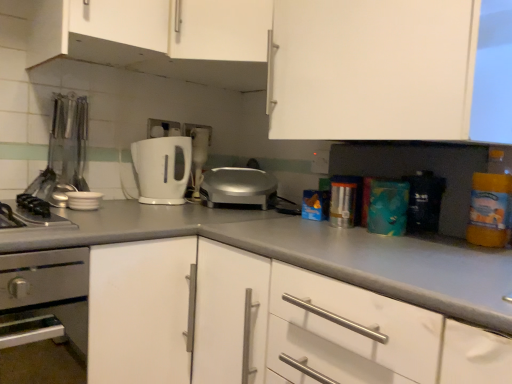
This screenshot has width=512, height=384. What do you see at coordinates (424, 201) in the screenshot? I see `teal matte box at center, which is the first appliance from right to left` at bounding box center [424, 201].

Describe the element at coordinates (161, 169) in the screenshot. I see `white glossy toaster at center, acting as the second toaster starting from the right` at that location.

From the picture: In order to face white matte cabinet at upper center, the 3th cabinetry positioned from the top, should I rotate leftwards or rightwards?

You should look right and rotate roughly 18.889 degrees.

How much space does white matte cabinet at upper center, the 3th cabinetry positioned from the top, occupy vertically?

53.85 centimeters.

I want to click on stainless steel oven at lower left, so click(44, 316).

In terms of height, does white glossy bowls at left, which is counted as the second appliance, starting from the left, look taller or shorter compared to metallic silver utensils at left, the 1th appliance positioned from the left?

white glossy bowls at left, which is counted as the second appliance, starting from the left, is shorter than metallic silver utensils at left, the 1th appliance positioned from the left.

Does white glossy bowls at left, the 2th appliance when ordered from right to left, touch metallic silver utensils at left, arranged as the third appliance when viewed from the right?

No, white glossy bowls at left, the 2th appliance when ordered from right to left, is not next to metallic silver utensils at left, arranged as the third appliance when viewed from the right.

Consider the image. Considering the positions of objects white glossy bowls at left, which is counted as the second appliance, starting from the left, and metallic silver utensils at left, the 1th appliance positioned from the left, in the image provided, who is in front, white glossy bowls at left, which is counted as the second appliance, starting from the left, or metallic silver utensils at left, the 1th appliance positioned from the left,?

Positioned in front is white glossy bowls at left, which is counted as the second appliance, starting from the left.

Do you think white glossy bowls at left, which is counted as the second appliance, starting from the left, is within metallic silver utensils at left, the 1th appliance positioned from the left, or outside of it?

white glossy bowls at left, which is counted as the second appliance, starting from the left, is not enclosed by metallic silver utensils at left, the 1th appliance positioned from the left.

Considering the sizes of objects teal matte box at center, which is the first appliance from right to left, and white plastic coffee machine at center in the image provided, who is bigger, teal matte box at center, which is the first appliance from right to left, or white plastic coffee machine at center?

With larger size is white plastic coffee machine at center.

From the picture: Is the surface of teal matte box at center, which is the first appliance from right to left, in direct contact with white plastic coffee machine at center?

No.

From a real-world perspective, who is located higher, teal matte box at center, the 3th appliance when ordered from left to right, or white plastic coffee machine at center?

white plastic coffee machine at center.

Is white matte countertop at center not within white matte cabinet at center, acting as the 4th cabinetry starting from the top?

Yes, white matte countertop at center is located beyond the bounds of white matte cabinet at center, acting as the 4th cabinetry starting from the top.

Can you confirm if white matte countertop at center is bigger than white matte cabinet at center, the first cabinetry in the bottom-to-top sequence?

Actually, white matte countertop at center might be smaller than white matte cabinet at center, the first cabinetry in the bottom-to-top sequence.

Considering the sizes of objects white matte countertop at center and white matte cabinet at center, acting as the 4th cabinetry starting from the top, in the image provided, who is wider, white matte countertop at center or white matte cabinet at center, acting as the 4th cabinetry starting from the top,?

With larger width is white matte countertop at center.

Where is `cabinetry below the white matte countertop at center (from a real-world perspective)`? The width and height of the screenshot is (512, 384). cabinetry below the white matte countertop at center (from a real-world perspective) is located at coordinates (310, 253).

Which object is more forward, teal matte box at center, which is the first appliance from right to left, or white matte cabinet at upper center, arranged as the fourth cabinetry when ordered from the bottom?

teal matte box at center, which is the first appliance from right to left.

Would you consider teal matte box at center, the 3th appliance when ordered from left to right, to be distant from white matte cabinet at upper center, which ranks as the 1th cabinetry in top-to-bottom order?

No, teal matte box at center, the 3th appliance when ordered from left to right, is not far from white matte cabinet at upper center, which ranks as the 1th cabinetry in top-to-bottom order.

In terms of width, does teal matte box at center, which is the first appliance from right to left, look wider or thinner when compared to white matte cabinet at upper center, arranged as the fourth cabinetry when ordered from the bottom?

Considering their sizes, teal matte box at center, which is the first appliance from right to left, looks slimmer than white matte cabinet at upper center, arranged as the fourth cabinetry when ordered from the bottom.

Is teal matte box at center, which is the first appliance from right to left, outside of white matte cabinet at upper center, which ranks as the 1th cabinetry in top-to-bottom order?

Yes.

In terms of size, does silver metallic toaster at center, which is the second toaster from left to right, appear bigger or smaller than white matte countertop at center?

In the image, silver metallic toaster at center, which is the second toaster from left to right, appears to be smaller than white matte countertop at center.

Considering their positions, is silver metallic toaster at center, the 1th toaster viewed from the right, located in front of or behind white matte countertop at center?

silver metallic toaster at center, the 1th toaster viewed from the right, is positioned farther from the viewer than white matte countertop at center.

From the image's perspective, does silver metallic toaster at center, the 1th toaster viewed from the right, appear lower than white matte countertop at center?

Incorrect, from the image's perspective, silver metallic toaster at center, the 1th toaster viewed from the right, is higher than white matte countertop at center.

Considering the positions of points (272, 206) and (450, 268), is point (272, 206) closer to camera compared to point (450, 268)?

No, (272, 206) is further to viewer.

Starting from the white glossy bowls at left, which is counted as the second appliance, starting from the left, which cabinetry is the 3rd one to the right? Please provide its 2D coordinates.

[(220, 30)]

Considering the sizes of white glossy bowls at left, the 2th appliance when ordered from right to left, and white matte cabinet at upper center, arranged as the fourth cabinetry when ordered from the bottom, in the image, is white glossy bowls at left, the 2th appliance when ordered from right to left, wider or thinner than white matte cabinet at upper center, arranged as the fourth cabinetry when ordered from the bottom,?

In the image, white glossy bowls at left, the 2th appliance when ordered from right to left, appears to be more narrow than white matte cabinet at upper center, arranged as the fourth cabinetry when ordered from the bottom.

From a real-world perspective, is white glossy bowls at left, the 2th appliance when ordered from right to left, physically located above or below white matte cabinet at upper center, which ranks as the 1th cabinetry in top-to-bottom order?

In terms of real-world spatial position, white glossy bowls at left, the 2th appliance when ordered from right to left, is below white matte cabinet at upper center, which ranks as the 1th cabinetry in top-to-bottom order.

Measure the distance between white glossy bowls at left, the 2th appliance when ordered from right to left, and white matte cabinet at upper center, arranged as the fourth cabinetry when ordered from the bottom.

They are 24.71 inches apart.

Is white glossy bowls at left, which is counted as the second appliance, starting from the left, surrounding white plastic coffee machine at center?

No, white glossy bowls at left, which is counted as the second appliance, starting from the left, does not contain white plastic coffee machine at center.

Is white glossy bowls at left, which is counted as the second appliance, starting from the left, positioned with its back to white plastic coffee machine at center?

white glossy bowls at left, which is counted as the second appliance, starting from the left, is not turned away from white plastic coffee machine at center.

Is white glossy bowls at left, which is counted as the second appliance, starting from the left, shorter than white plastic coffee machine at center?

Correct, white glossy bowls at left, which is counted as the second appliance, starting from the left, is not as tall as white plastic coffee machine at center.

Is white glossy bowls at left, the 2th appliance when ordered from right to left, next to white plastic coffee machine at center and touching it?

No, white glossy bowls at left, the 2th appliance when ordered from right to left, is not next to white plastic coffee machine at center.

This screenshot has height=384, width=512. In order to click on appliance that is the 2nd object directly below the metallic silver utensils at left, the 1th appliance positioned from the left (from a real-world perspective) in this screenshot , I will do `click(84, 200)`.

Where is `appliance to the right of white plastic coffee machine at center`? This screenshot has height=384, width=512. appliance to the right of white plastic coffee machine at center is located at coordinates (424, 201).

Estimate the real-world distances between objects in this image. Which object is closer to white matte cabinet at upper center, the 3th cabinetry from the bottom, white glossy toaster at center, acting as the second toaster starting from the right, or white matte cabinet at center, acting as the 4th cabinetry starting from the top?

white glossy toaster at center, acting as the second toaster starting from the right.

Looking at the image, which one is located closer to teal matte box at center, which is the first appliance from right to left, metallic silver utensils at left, arranged as the third appliance when viewed from the right, or white glossy bowls at left, which is counted as the second appliance, starting from the left?

white glossy bowls at left, which is counted as the second appliance, starting from the left.

Estimate the real-world distances between objects in this image. Which object is closer to white matte cabinet at upper center, which ranks as the 1th cabinetry in top-to-bottom order, teal matte box at center, the 3th appliance when ordered from left to right, or white plastic coffee machine at center?

The object closer to white matte cabinet at upper center, which ranks as the 1th cabinetry in top-to-bottom order, is white plastic coffee machine at center.

Considering their positions, is translucent plastic bottle at right positioned closer to white matte cabinet at upper center, the 3th cabinetry from the bottom, than teal matte box at center, the 3th appliance when ordered from left to right?

The object closer to white matte cabinet at upper center, the 3th cabinetry from the bottom, is teal matte box at center, the 3th appliance when ordered from left to right.

Looking at the image, which one is located further to silver metallic toaster at center, the 1th toaster viewed from the right, metallic silver utensils at left, arranged as the third appliance when viewed from the right, or teal matte box at center, the 3th appliance when ordered from left to right?

teal matte box at center, the 3th appliance when ordered from left to right.

Which object lies further to the anchor point translucent plastic bottle at right, white glossy toaster at center, acting as the second toaster starting from the right, or white matte cabinet at upper center, the second cabinetry positioned from the top?

Based on the image, white matte cabinet at upper center, the second cabinetry positioned from the top, appears to be further to translucent plastic bottle at right.

When comparing their distances from teal matte box at center, the 3th appliance when ordered from left to right, does white matte countertop at center or silver metallic toaster at center, which is the second toaster from left to right, seem further?

Based on the image, silver metallic toaster at center, which is the second toaster from left to right, appears to be further to teal matte box at center, the 3th appliance when ordered from left to right.

Considering their positions, is white plastic coffee machine at center positioned closer to metallic silver utensils at left, the 1th appliance positioned from the left, than white matte cabinet at upper center, the second cabinetry positioned from the top?

white matte cabinet at upper center, the second cabinetry positioned from the top, lies closer to metallic silver utensils at left, the 1th appliance positioned from the left, than the other object.

Identify the location of appliance situated between metallic silver utensils at left, arranged as the third appliance when viewed from the right, and white matte countertop at center from left to right. The width and height of the screenshot is (512, 384). (84, 200).

Locate an element on the screen. The image size is (512, 384). toaster that lies between white matte cabinet at upper center, arranged as the fourth cabinetry when ordered from the bottom, and silver metallic toaster at center, the 1th toaster viewed from the right, from top to bottom is located at coordinates tap(161, 169).

The height and width of the screenshot is (384, 512). What are the coordinates of `toaster between white glossy toaster at center, the first toaster when ordered from left to right, and white matte cabinet at center, the first cabinetry in the bottom-to-top sequence, in the vertical direction` in the screenshot? It's located at (238, 187).

Find the location of `toaster between white plastic coffee machine at center and teal matte box at center, the 3th appliance when ordered from left to right, from left to right`. toaster between white plastic coffee machine at center and teal matte box at center, the 3th appliance when ordered from left to right, from left to right is located at coordinates (238, 187).